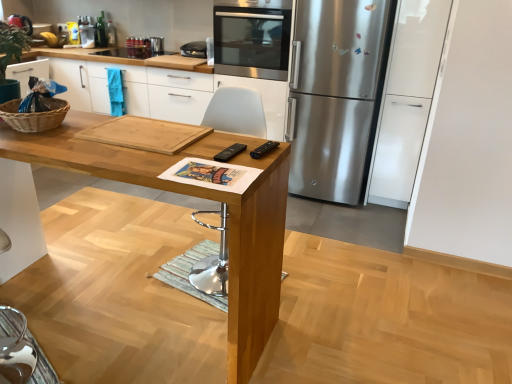
Locate an element on the screen. The image size is (512, 384). white plastic chair at center is located at coordinates (236, 112).

Describe the element at coordinates (155, 87) in the screenshot. This screenshot has height=384, width=512. I see `natural wood cutting board at center` at that location.

Describe the element at coordinates (252, 38) in the screenshot. The height and width of the screenshot is (384, 512). I see `stainless steel oven at upper center` at that location.

In order to click on woven brown basket at left in this screenshot , I will do `click(34, 115)`.

What do you see at coordinates (145, 134) in the screenshot?
I see `natural wood cutting board at center` at bounding box center [145, 134].

Locate an element on the screen. white plastic chair at center is located at coordinates (236, 112).

From a real-world perspective, is woven brown basket at left on top of stainless steel oven at upper center?

No, from a real-world perspective, woven brown basket at left is not over stainless steel oven at upper center

Consider the image. How much distance is there between woven brown basket at left and stainless steel oven at upper center?

1.77 meters.

Is woven brown basket at left inside or outside of stainless steel oven at upper center?

woven brown basket at left exists outside the volume of stainless steel oven at upper center.

Considering their positions, is woven brown basket at left located in front of or behind stainless steel oven at upper center?

Clearly, woven brown basket at left is in front of stainless steel oven at upper center.

How distant is stainless steel refrigerator at right from natural wood cutting board at center?

stainless steel refrigerator at right and natural wood cutting board at center are 29.41 inches apart.

In the scene shown: Does stainless steel refrigerator at right have a lesser width compared to natural wood cutting board at center?

In fact, stainless steel refrigerator at right might be wider than natural wood cutting board at center.

From the image's perspective, is stainless steel refrigerator at right on natural wood cutting board at center?

Incorrect, from the image's perspective, stainless steel refrigerator at right is lower than natural wood cutting board at center.

Considering the relative positions of stainless steel refrigerator at right and natural wood cutting board at center in the image provided, is stainless steel refrigerator at right behind natural wood cutting board at center?

No, stainless steel refrigerator at right is in front of natural wood cutting board at center.

Considering the relative sizes of natural wood cutting board at center and stainless steel refrigerator at right in the image provided, is natural wood cutting board at center shorter than stainless steel refrigerator at right?

Correct, natural wood cutting board at center is not as tall as stainless steel refrigerator at right.

Is natural wood cutting board at center in contact with stainless steel refrigerator at right?

No, natural wood cutting board at center is not beside stainless steel refrigerator at right.

Can stainless steel refrigerator at right be found inside natural wood cutting board at center?

That's incorrect, stainless steel refrigerator at right is not inside natural wood cutting board at center.

Is natural wood cutting board at center closer to the viewer compared to stainless steel refrigerator at right?

Yes, it is in front of stainless steel refrigerator at right.

From the image's perspective, which object appears higher, woven brown basket at left or natural wood cutting board at center?

woven brown basket at left is shown above in the image.

Based on their sizes in the image, would you say woven brown basket at left is bigger or smaller than natural wood cutting board at center?

woven brown basket at left is bigger than natural wood cutting board at center.

In terms of height, does woven brown basket at left look taller or shorter compared to natural wood cutting board at center?

In the image, woven brown basket at left appears to be taller than natural wood cutting board at center.

Which object is positioned more to the left, woven brown basket at left or natural wood cutting board at center?

Positioned to the left is woven brown basket at left.

Does point (132, 132) appear closer or farther from the camera than point (277, 226)?

Point (132, 132).

Is natural wood cutting board at center surrounding natural wood table at center?

That's incorrect, natural wood table at center is not inside natural wood cutting board at center.

Is natural wood cutting board at center turned away from natural wood table at center?

That's right, natural wood cutting board at center is facing away from natural wood table at center.

From a real-world perspective, is natural wood cutting board at center physically located above or below natural wood table at center?

In terms of real-world spatial position, natural wood cutting board at center is above natural wood table at center.

Is point (378, 56) positioned in front of point (234, 248)?

No, (378, 56) is further to viewer.

In terms of width, does stainless steel refrigerator at right look wider or thinner when compared to natural wood table at center?

Considering their sizes, stainless steel refrigerator at right looks broader than natural wood table at center.

Would you say stainless steel refrigerator at right is a long distance from natural wood table at center?

Absolutely, stainless steel refrigerator at right is distant from natural wood table at center.

How different are the orientations of stainless steel refrigerator at right and natural wood table at center in degrees?

They differ by 180 degrees in their facing directions.

From the image's perspective, is natural wood cutting board at center under natural wood table at center?

No, from the image's perspective, natural wood cutting board at center is not beneath natural wood table at center.

Which is more distant, (x=204, y=82) or (x=100, y=161)?

Point (x=204, y=82)

Between natural wood cutting board at center and natural wood table at center, which one is positioned behind?

natural wood cutting board at center.

Image resolution: width=512 pixels, height=384 pixels. What are the coordinates of `home appliance positioned vertically above the woven brown basket at left (from a real-world perspective)` in the screenshot? It's located at (252, 38).

I want to click on cabinetry lying behind the stainless steel refrigerator at right, so click(155, 87).

Considering their positions, is natural wood cutting board at center positioned further to stainless steel oven at upper center than natural wood table at center?

natural wood table at center is further to stainless steel oven at upper center.

Which object lies nearer to the anchor point natural wood table at center, stainless steel oven at upper center or stainless steel refrigerator at right?

stainless steel refrigerator at right is closer to natural wood table at center.

Which object lies nearer to the anchor point stainless steel refrigerator at right, white plastic chair at center or natural wood cutting board at center?

white plastic chair at center is closer to stainless steel refrigerator at right.

Based on their spatial positions, is stainless steel refrigerator at right or natural wood cutting board at center further from white plastic chair at center?

stainless steel refrigerator at right is further to white plastic chair at center.

When comparing their distances from natural wood cutting board at center, does stainless steel oven at upper center or natural wood cutting board at center seem closer?

stainless steel oven at upper center lies closer to natural wood cutting board at center than the other object.

In the scene shown: Looking at the image, which one is located further to stainless steel refrigerator at right, natural wood table at center or woven brown basket at left?

The object further to stainless steel refrigerator at right is woven brown basket at left.

Looking at the image, which one is located further to stainless steel oven at upper center, woven brown basket at left or natural wood cutting board at center?

woven brown basket at left lies further to stainless steel oven at upper center than the other object.

Based on their spatial positions, is natural wood table at center or natural wood cutting board at center further from white plastic chair at center?

natural wood cutting board at center is positioned further to the anchor white plastic chair at center.

Identify the location of home appliance located between natural wood table at center and natural wood cutting board at center in the depth direction. (252, 38).

Identify the location of basket between natural wood table at center and natural wood cutting board at center from front to back. (34, 115).

Where is `home appliance between natural wood cutting board at center and stainless steel refrigerator at right`? home appliance between natural wood cutting board at center and stainless steel refrigerator at right is located at coordinates (252, 38).

At what (x,y) coordinates should I click in order to perform the action: click on refrigerator between natural wood cutting board at center and stainless steel oven at upper center from front to back. Please return your answer as a coordinate pair (x, y). The image size is (512, 384). Looking at the image, I should click on (334, 95).